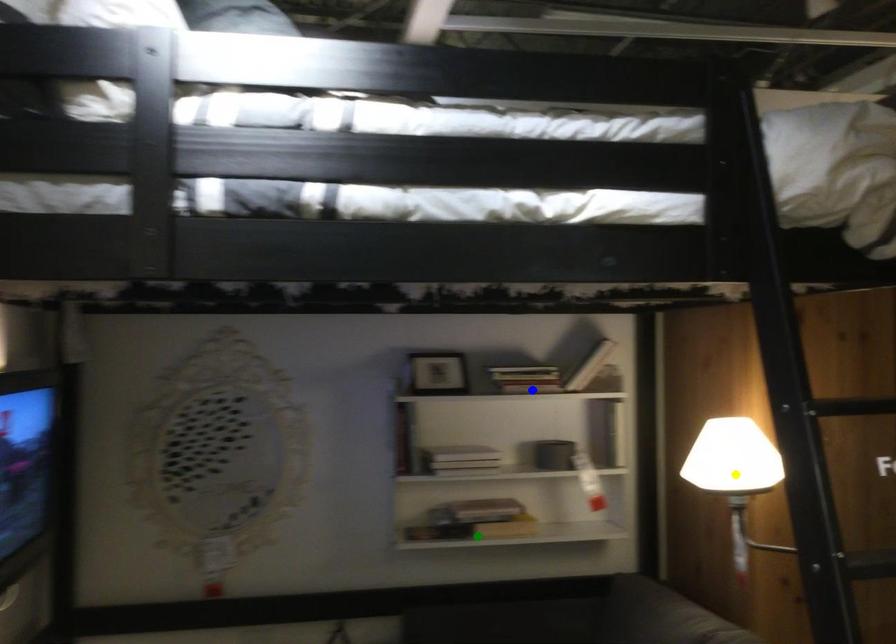
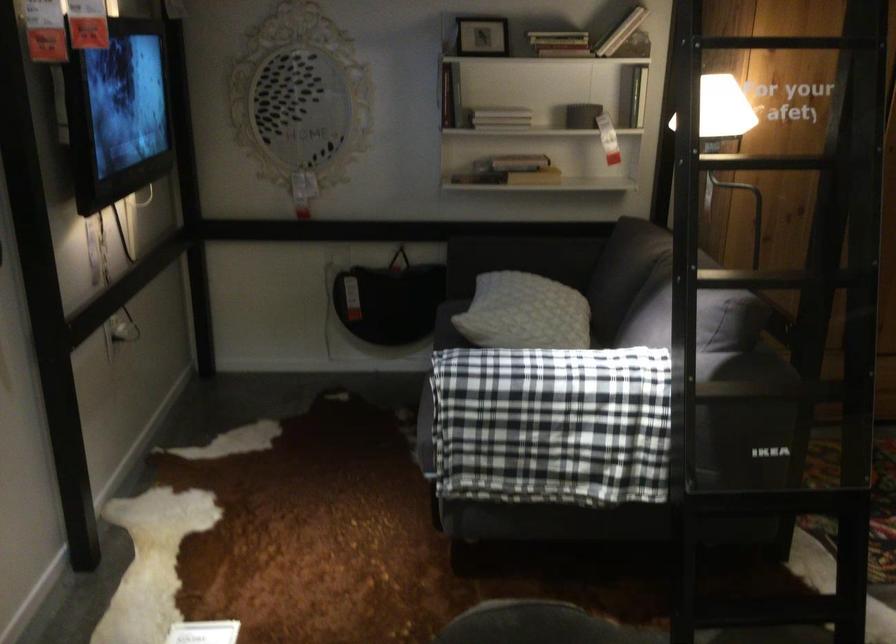
I am providing you with two images of the same scene from different viewpoints. Three points are marked in image1. Which point corresponds to a part or object that is occluded in image2?In image1, three points are marked. Which of them correspond to a part or object that is occluded in image2?Among the three points shown in image1, which one corresponds to a part or object that is no longer visible due to occlusion in image2?

Invisible in image2: yellow point.